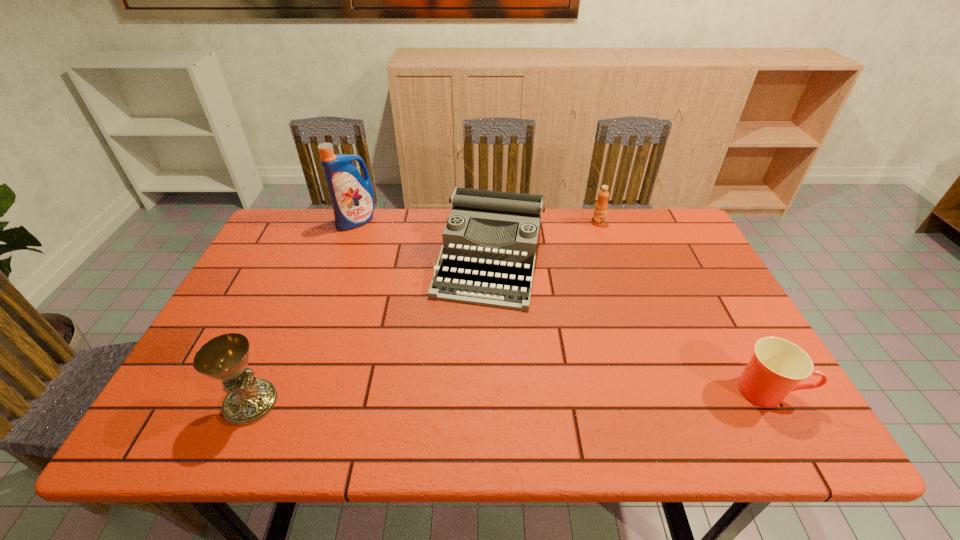
Find the location of a particular element. The image size is (960, 540). vacant space at the near right corner is located at coordinates (708, 392).

This screenshot has width=960, height=540. I want to click on vacant area that lies between the chalice and the tallest object, so click(x=304, y=312).

Locate an element on the screen. vacant space that's between the chalice and the second object from right to left is located at coordinates (424, 313).

You are a GUI agent. You are given a task and a screenshot of the screen. Output one action in this format:
    pyautogui.click(x=<x>, y=<y>)
    Task: Click on the free point between the third object from right to left and the orange juice
    The height and width of the screenshot is (540, 960).
    Given the screenshot: What is the action you would take?
    pyautogui.click(x=543, y=240)

You are a GUI agent. You are given a task and a screenshot of the screen. Output one action in this format:
    pyautogui.click(x=<x>, y=<y>)
    Task: Click on the free space that is in between the third object from right to left and the second tallest object
    Image resolution: width=960 pixels, height=540 pixels.
    Given the screenshot: What is the action you would take?
    tap(371, 330)

Identify the location of vacant area that lies between the fourth shortest object and the cup. (510, 396).

The width and height of the screenshot is (960, 540). What are the coordinates of `free space between the chalice and the tallest object` in the screenshot? It's located at (304, 312).

This screenshot has height=540, width=960. What are the coordinates of `free area in between the rightmost object and the orange juice` in the screenshot? It's located at (683, 307).

Image resolution: width=960 pixels, height=540 pixels. What are the coordinates of `free point between the typewriter and the second object from right to left` in the screenshot? It's located at (543, 240).

Locate an element on the screen. The height and width of the screenshot is (540, 960). vacant space that is in between the tallest object and the typewriter is located at coordinates (423, 240).